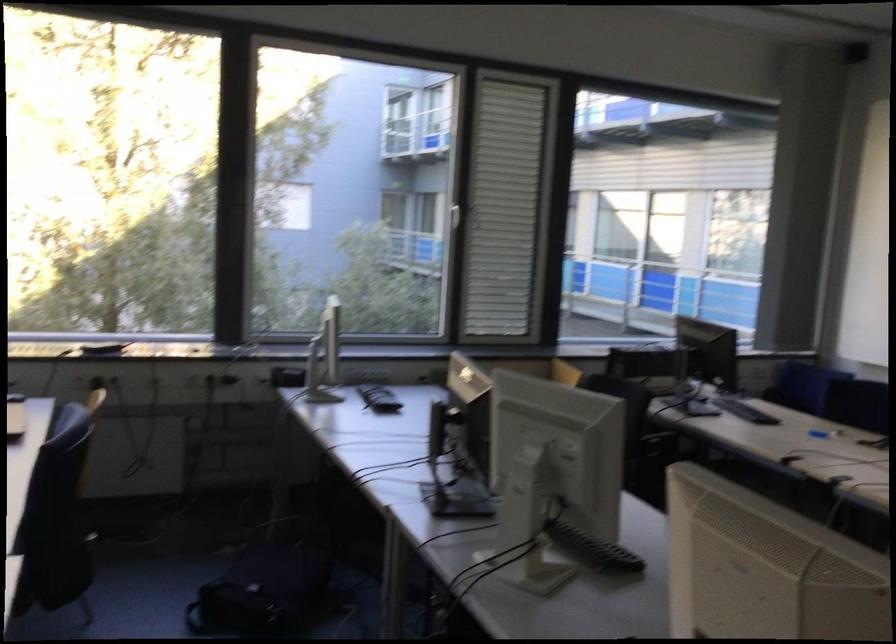
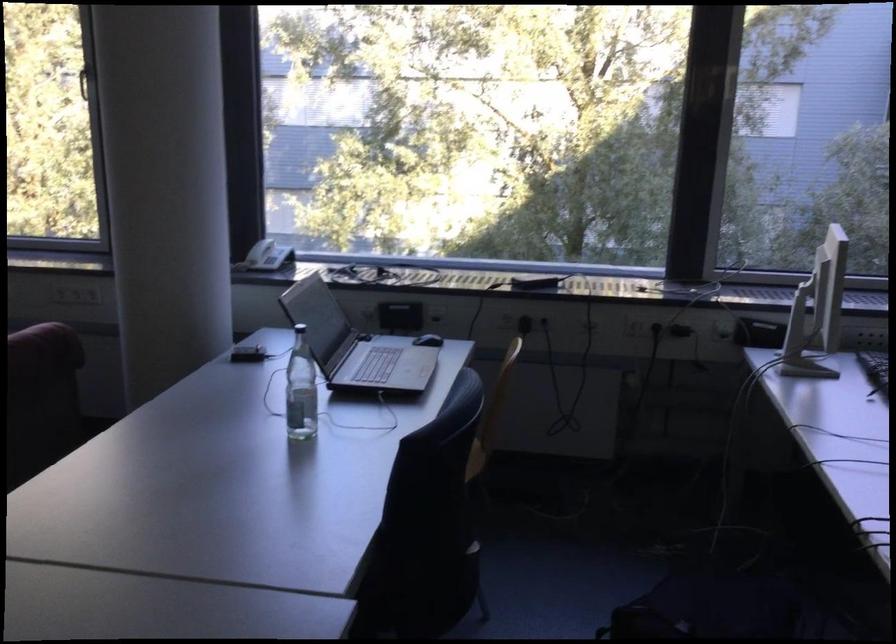
Question: The images are taken continuously from a first-person perspective. In which direction is your viewpoint rotating?

Choices:
 (A) Left
 (B) Right
 (C) Up
 (D) Down

Answer: (A)